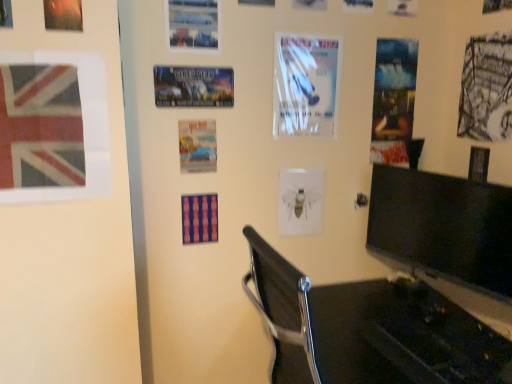
Question: Could you tell me if matte blue poster at upper right, which ranks as the fifth poster page in left-to-right order, is turned towards metallic silver poster at upper left, positioned as the 6th poster page in back-to-front order?

Choices:
 (A) no
 (B) yes

Answer: (A)

Question: Can you confirm if matte blue poster at upper right, arranged as the third poster page when viewed from the right, is thinner than metallic silver poster at upper left, which is the 2th poster page from left to right?

Choices:
 (A) no
 (B) yes

Answer: (B)

Question: Considering the relative positions of matte blue poster at upper right, arranged as the third poster page when viewed from the right, and metallic silver poster at upper left, positioned as the 6th poster page in back-to-front order, in the image provided, is matte blue poster at upper right, arranged as the third poster page when viewed from the right, in front of metallic silver poster at upper left, positioned as the 6th poster page in back-to-front order,?

Choices:
 (A) yes
 (B) no

Answer: (B)

Question: Is matte blue poster at upper right, the 7th poster page viewed from the front, taller than metallic silver poster at upper left, the 2th poster page viewed from the front?

Choices:
 (A) yes
 (B) no

Answer: (A)

Question: Are matte blue poster at upper right, placed as the 1th poster page when sorted from back to front, and metallic silver poster at upper left, the 2th poster page viewed from the front, located far from each other?

Choices:
 (A) yes
 (B) no

Answer: (A)

Question: From the image's perspective, does matte blue poster at upper right, placed as the 1th poster page when sorted from back to front, appear lower than metallic silver poster at upper left, positioned as the 6th poster page in back-to-front order?

Choices:
 (A) no
 (B) yes

Answer: (B)

Question: Does matte blue poster at upper right, which ranks as the fifth poster page in left-to-right order, turn towards matte striped poster at center, which appears as the 5th poster page when viewed from the right?

Choices:
 (A) yes
 (B) no

Answer: (B)

Question: Does matte blue poster at upper right, placed as the 1th poster page when sorted from back to front, have a lesser height compared to matte striped poster at center, which is counted as the third poster page, starting from the left?

Choices:
 (A) yes
 (B) no

Answer: (B)

Question: Is the surface of matte blue poster at upper right, placed as the 1th poster page when sorted from back to front, in direct contact with matte striped poster at center, which is counted as the fourth poster page, starting from the back?

Choices:
 (A) yes
 (B) no

Answer: (B)

Question: Does matte blue poster at upper right, the 7th poster page viewed from the front, have a smaller size compared to matte striped poster at center, which is counted as the third poster page, starting from the left?

Choices:
 (A) no
 (B) yes

Answer: (A)

Question: Considering the relative sizes of matte blue poster at upper right, placed as the 1th poster page when sorted from back to front, and matte striped poster at center, which appears as the 5th poster page when viewed from the right, in the image provided, is matte blue poster at upper right, placed as the 1th poster page when sorted from back to front, bigger than matte striped poster at center, which appears as the 5th poster page when viewed from the right,?

Choices:
 (A) no
 (B) yes

Answer: (B)

Question: Could matte striped poster at center, which appears as the 5th poster page when viewed from the right, be considered to be inside matte blue poster at upper right, which ranks as the fifth poster page in left-to-right order?

Choices:
 (A) no
 (B) yes

Answer: (A)

Question: Is matte paper poster at center, the 2th poster positioned from the bottom, positioned behind matte striped poster at center, which is counted as the fourth poster page, starting from the back?

Choices:
 (A) yes
 (B) no

Answer: (B)